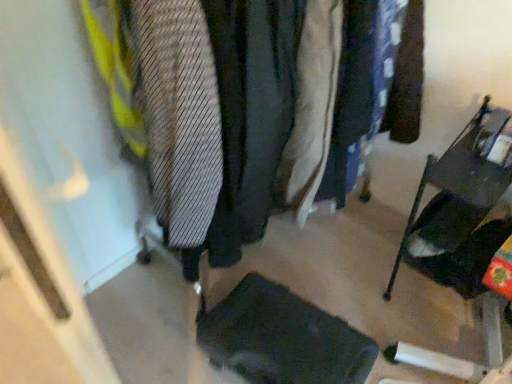
Find the location of a particular element. This screenshot has width=512, height=384. free space below metallic dark gray folding chair at right (from a real-world perspective) is located at coordinates (449, 303).